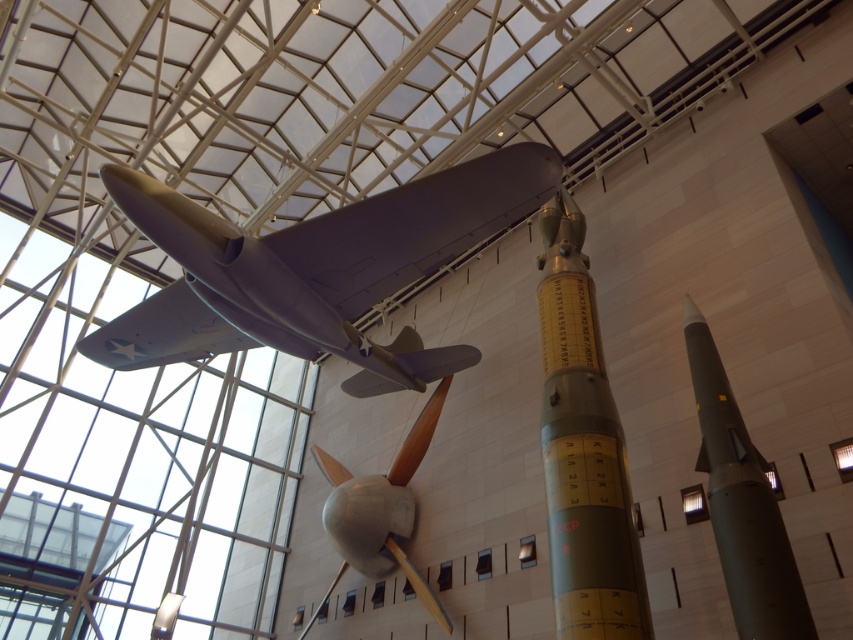
Looking at this image, you are a visitor in the museum and want to take a photo of the green metallic rocket at center. Where should you position yourself to capture it in the best possible angle? Please provide coordinates in the format of x,y where x and y are between 0 and 1.

The green metallic rocket at center is located at coordinates point (583, 449). To capture it in the best angle, you should position yourself directly in front of it, which would be at approximately x,y coordinates of (583, 449).

You are a museum visitor who wants to take a photo of the matte gray airplane at center and the silver metallic propeller at center. The camera you have can focus on objects up to 5 meters away. Will you be able to capture both in one shot without moving closer?

The distance between the matte gray airplane at center and the silver metallic propeller at center is 6.06 meters. Since the camera can only focus up to 5 meters, you won cannot capture both in one shot without moving closer.